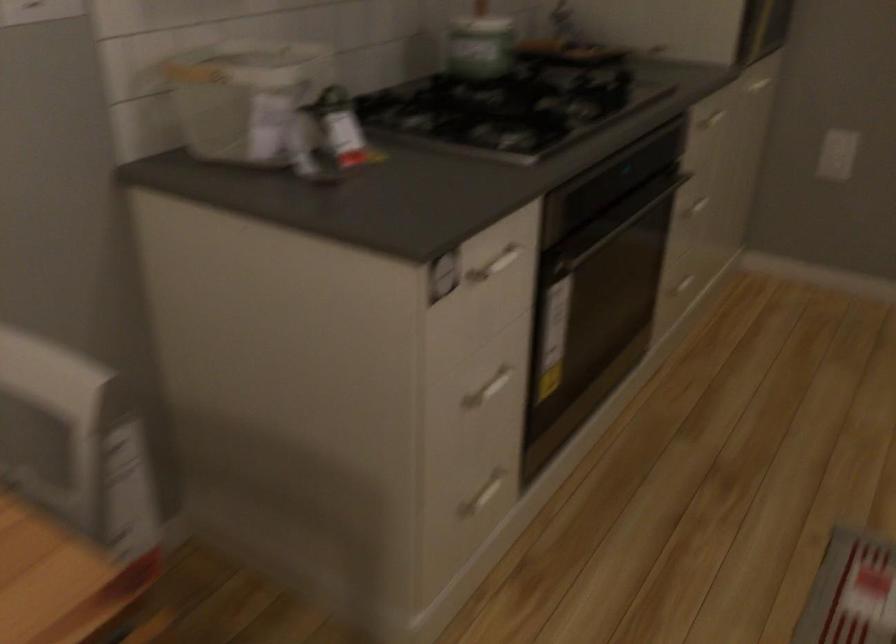
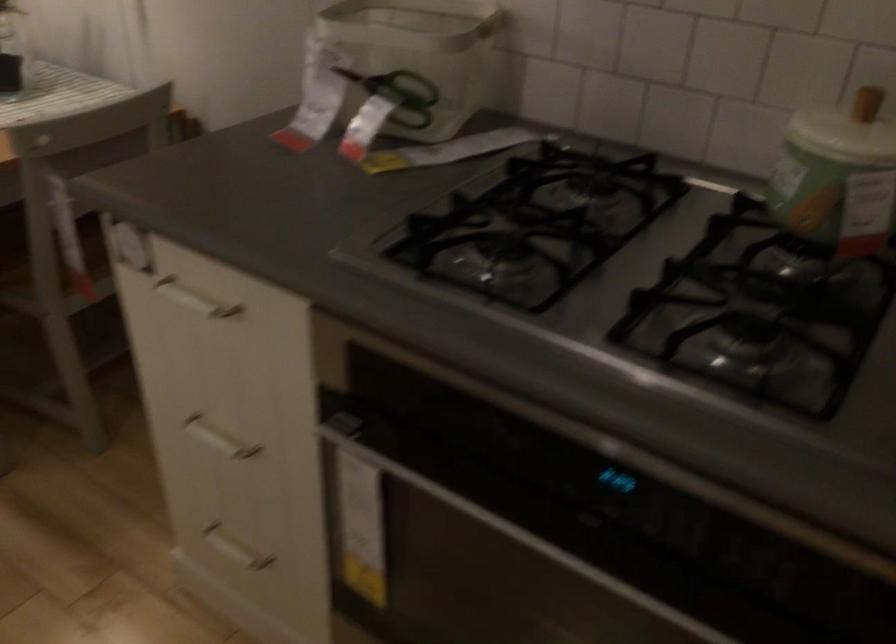
Where in the second image is the point corresponding to pixel 474 518 from the first image?

(234, 549)